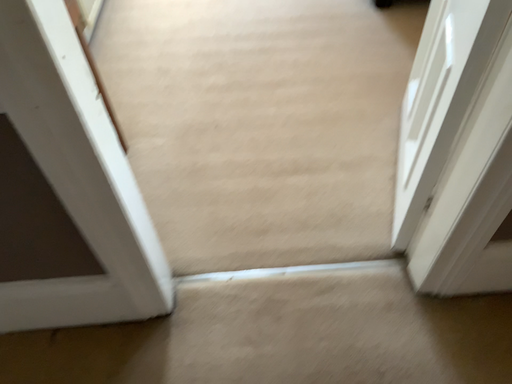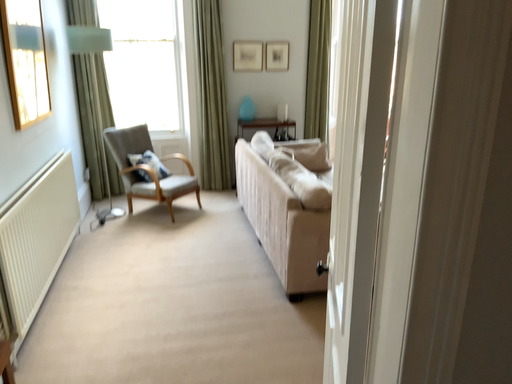
Question: Which way did the camera rotate in the video?

Choices:
 (A) rotated left
 (B) rotated right

Answer: (B)